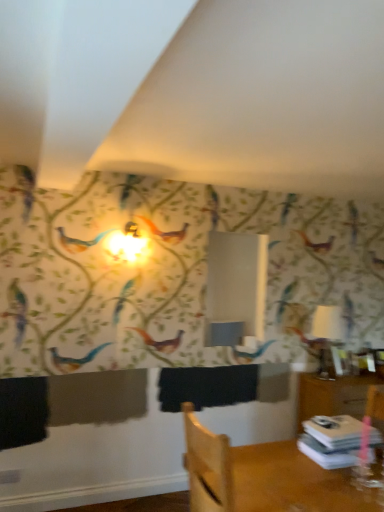
Question: Is wooden chair at lower right taller or shorter than white paper stack at lower right?

Choices:
 (A) short
 (B) tall

Answer: (B)

Question: Looking at their shapes, would you say wooden chair at lower right is wider or thinner than white paper stack at lower right?

Choices:
 (A) wide
 (B) thin

Answer: (A)

Question: Which object is the closest to the white glossy table lamp at right?

Choices:
 (A) white paper stack at lower right
 (B) wooden chair at lower right

Answer: (A)

Question: Based on their relative distances, which object is nearer to the white paper stack at lower right?

Choices:
 (A) wooden chair at lower right
 (B) white glossy table lamp at right

Answer: (A)